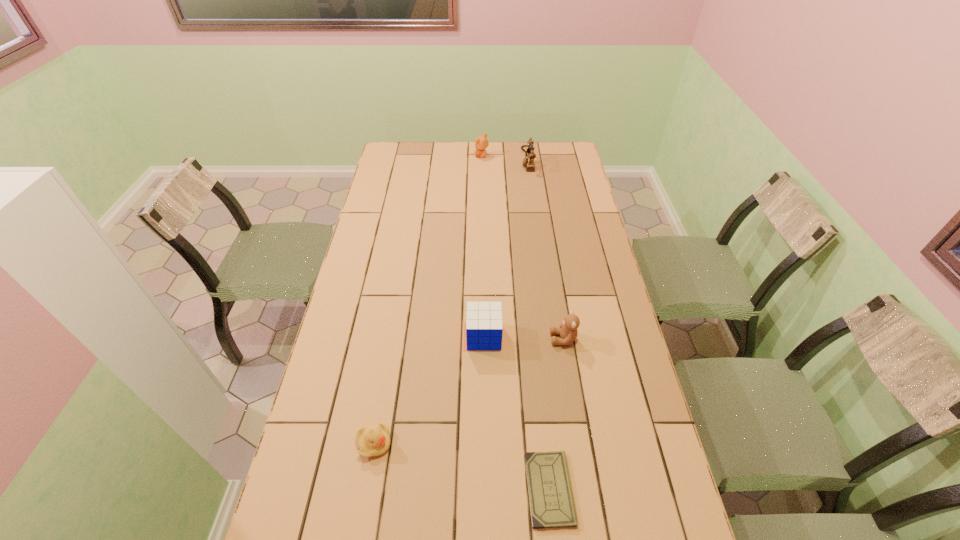
Find the location of a particular element. vacant area in the image that satisfies the following two spatial constraints: 1. on the face of the left teddy bear; 2. on the left side of the shortest object is located at coordinates (484, 489).

What are the coordinates of `free space that satisfies the following two spatial constraints: 1. on the beak of the shortest object; 2. on the left side of the leftmost object` in the screenshot? It's located at (367, 489).